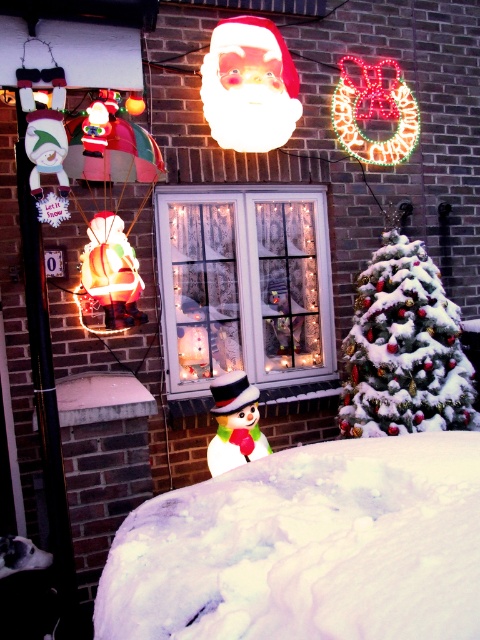
Question: Among these points, which one is farthest from the camera?

Choices:
 (A) (439, 387)
 (B) (228, 380)

Answer: (A)

Question: Among these objects, which one is nearest to the camera?

Choices:
 (A) white fluffy snowman at lower center
 (B) white frosted glass window at center
 (C) snow-covered green christmas tree at right

Answer: (A)

Question: Does white fluffy snowman at lower center appear over white glossy snowman at lower center?

Choices:
 (A) no
 (B) yes

Answer: (A)

Question: Does white fluffy snowman at lower center come in front of white frosted glass window at center?

Choices:
 (A) no
 (B) yes

Answer: (B)

Question: Which point is farther from the camera taking this photo?

Choices:
 (A) (256, 422)
 (B) (201, 244)

Answer: (B)

Question: Is snow-covered green christmas tree at right above white glossy snowman at lower center?

Choices:
 (A) no
 (B) yes

Answer: (B)